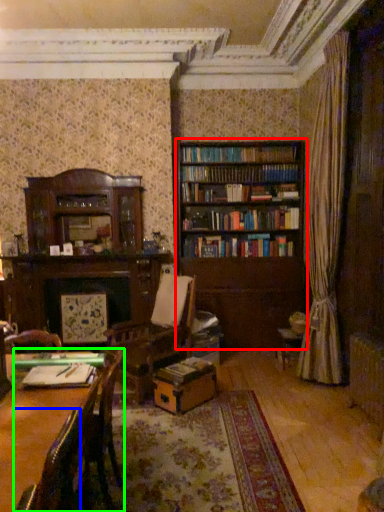
Question: Estimate the real-world distances between objects in this image. Which object is farther from bookcase (highlighted by a red box), chair (highlighted by a blue box) or chair (highlighted by a green box)?

Choices:
 (A) chair
 (B) chair

Answer: (A)